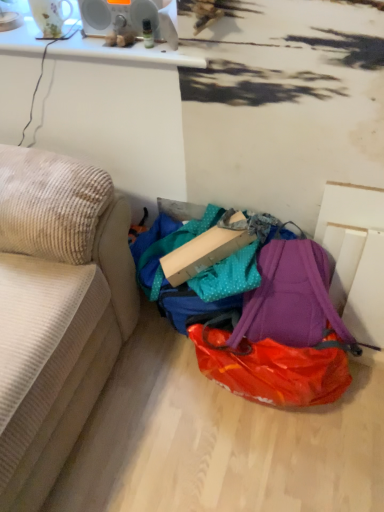
Question: Is purple fabric backpack at lower center spatially inside cardboard box at center, or outside of it?

Choices:
 (A) outside
 (B) inside

Answer: (A)

Question: Considering the positions of point (180, 241) and point (210, 257), is point (180, 241) closer or farther from the camera than point (210, 257)?

Choices:
 (A) farther
 (B) closer

Answer: (A)

Question: Estimate the real-world distances between objects in this image. Which object is farther from the beige corduroy couch at left?

Choices:
 (A) cardboard box at center
 (B) purple fabric backpack at lower center

Answer: (B)

Question: Estimate the real-world distances between objects in this image. Which object is closer to the purple fabric backpack at lower center?

Choices:
 (A) cardboard box at center
 (B) beige corduroy couch at left

Answer: (A)